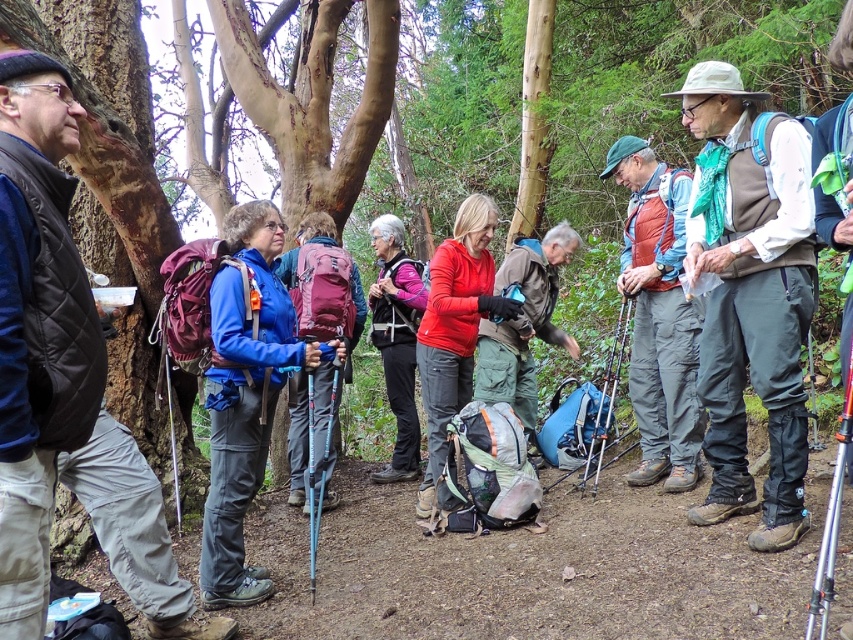
You are a hiker looking at the group in the forest. You notice two people wearing the matte red vest at center and the matte blue jacket at center. Which of these two is standing higher up on the trail?

The matte red vest at center is located above the matte blue jacket at center, so the person wearing the matte red vest at center is standing higher up on the trail.

You are a drone operator trying to capture the best aerial shot of the hiking group. You need to adjust your drone so that both the point at coordinates point (682, 390) and point (277, 268) are in focus. Which point should you focus on first to ensure both are sharp?

You should focus on point (682, 390) first because it is closer to the camera than point (277, 268). By focusing on the closer point, the farther point will also be in focus due to the depth of field.

You are a hiker trying to determine the order of the hikers in the group. Looking at the blue fabric jacket at center and the matte red vest at center, which one is closer to you?

The blue fabric jacket at center is closer to you since it is in front of the matte red vest at center.